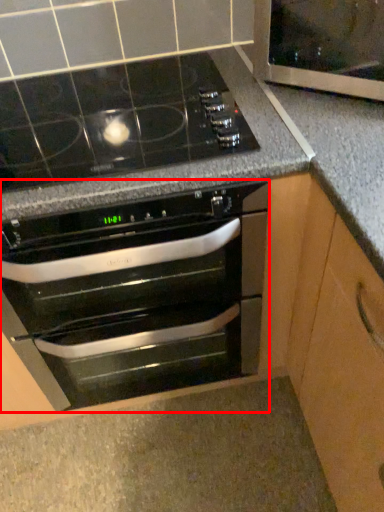
Question: From the image, what is the correct spatial relationship of oven (annotated by the red box) in relation to glass door?

Choices:
 (A) right
 (B) left

Answer: (B)